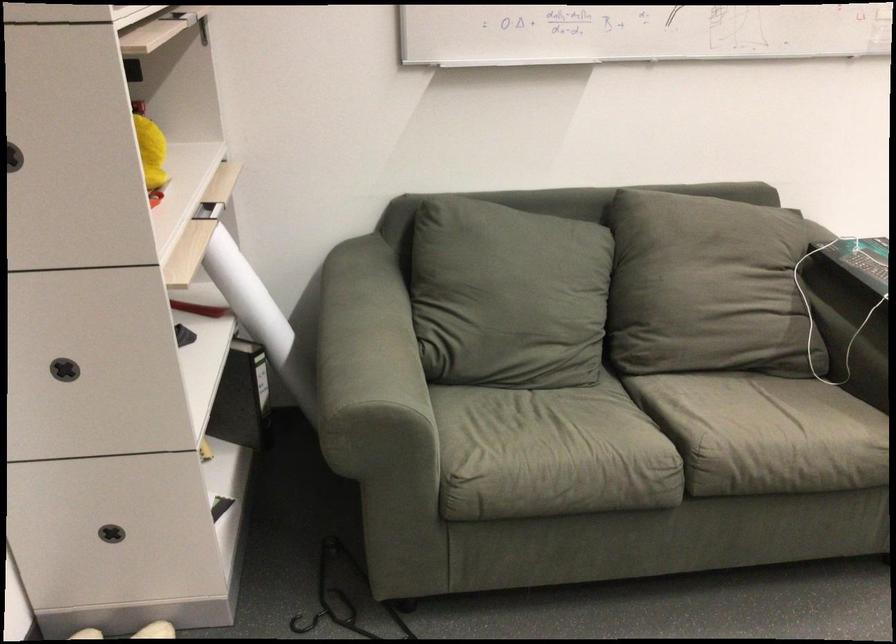
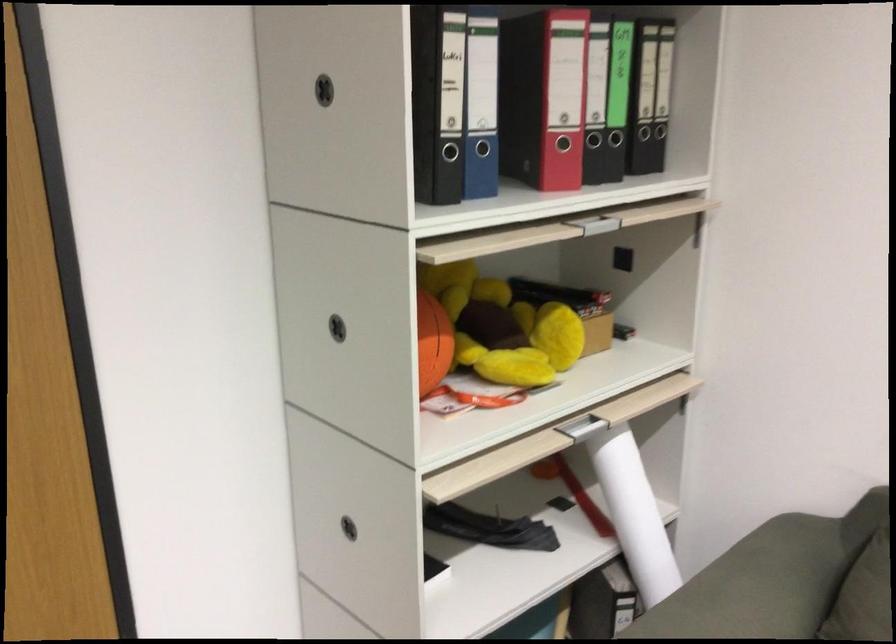
Where in the second image is the point corresponding to pixel 212 207 from the first image?

(595, 421)